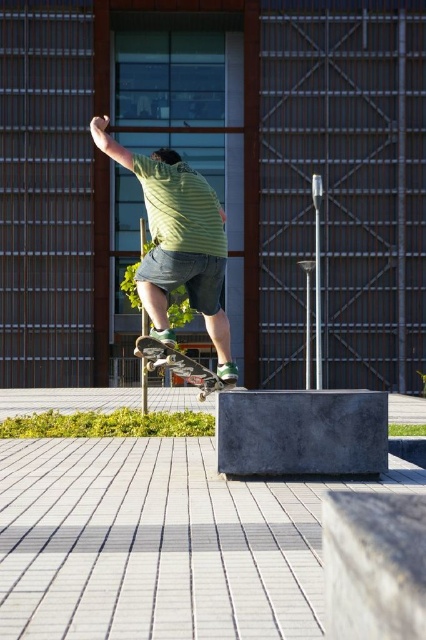
Question: Which object is farther from the camera taking this photo?

Choices:
 (A) wooden skateboard at center
 (B) green striped shirt at upper center

Answer: (A)

Question: Which object is closer to the camera taking this photo?

Choices:
 (A) green striped shirt at upper center
 (B) wooden skateboard at center

Answer: (A)

Question: Can you confirm if green striped shirt at upper center is positioned to the left of wooden skateboard at center?

Choices:
 (A) yes
 (B) no

Answer: (B)

Question: Does green striped shirt at upper center have a smaller size compared to wooden skateboard at center?

Choices:
 (A) no
 (B) yes

Answer: (A)

Question: Is green striped shirt at upper center below wooden skateboard at center?

Choices:
 (A) yes
 (B) no

Answer: (B)